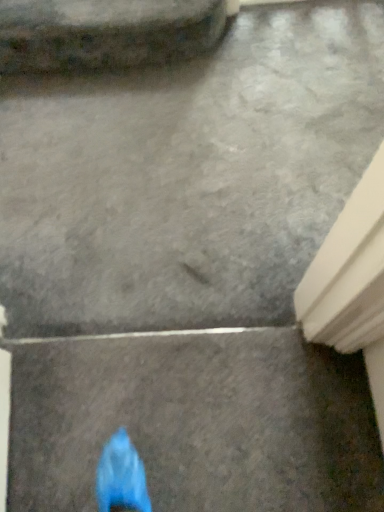
In order to face gray concrete at center, should I rotate leftwards or rightwards?

To align with it, rotate right about 0.826°.

You are a GUI agent. You are given a task and a screenshot of the screen. Output one action in this format:
    pyautogui.click(x=<x>, y=<y>)
    Task: Click on the gray concrete at center
    This screenshot has width=384, height=512.
    Given the screenshot: What is the action you would take?
    pyautogui.click(x=188, y=176)

Describe the element at coordinates (188, 176) in the screenshot. I see `gray concrete at center` at that location.

Identify the location of gray concrete at center. point(188,176).